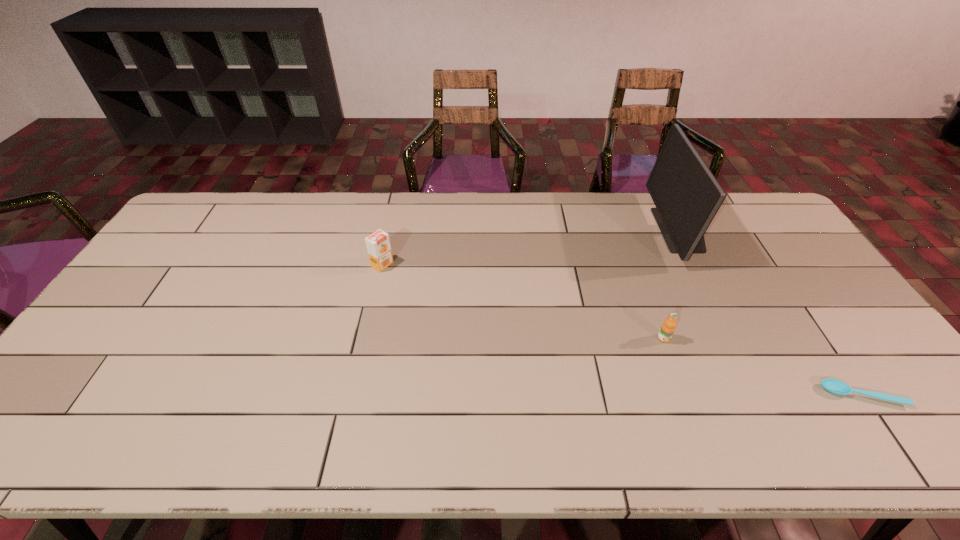
You are a GUI agent. You are given a task and a screenshot of the screen. Output one action in this format:
    pyautogui.click(x=<x>, y=<y>)
    Task: Click on the vacant area that lies between the second shortest object and the second tallest object
    The image size is (960, 540).
    Given the screenshot: What is the action you would take?
    pyautogui.click(x=523, y=302)

Locate an element on the screen. The width and height of the screenshot is (960, 540). unoccupied position between the second object from right to left and the second shortest object is located at coordinates (672, 284).

Where is `vacant space that is in between the rightmost object and the computer monitor`? The image size is (960, 540). vacant space that is in between the rightmost object and the computer monitor is located at coordinates (771, 313).

The width and height of the screenshot is (960, 540). What are the coordinates of `empty space between the second shortest object and the shortest object` in the screenshot? It's located at (763, 367).

At what (x,y) coordinates should I click in order to perform the action: click on free spot between the nearer orange juice and the nearest object. Please return your answer as a coordinate pair (x, y). This screenshot has height=540, width=960. Looking at the image, I should click on (763, 367).

You are a GUI agent. You are given a task and a screenshot of the screen. Output one action in this format:
    pyautogui.click(x=<x>, y=<y>)
    Task: Click on the vacant area that lies between the tallest object and the second object from left to right
    The image size is (960, 540).
    Given the screenshot: What is the action you would take?
    pyautogui.click(x=672, y=284)

Identify the location of free space between the right orange juice and the third object from left to right. Image resolution: width=960 pixels, height=540 pixels. (672, 284).

This screenshot has width=960, height=540. What are the coordinates of `vacant space that is in between the third tallest object and the spoon` in the screenshot? It's located at (763, 367).

Where is `free space between the farther orange juice and the rightmost object`? This screenshot has width=960, height=540. free space between the farther orange juice and the rightmost object is located at coordinates (622, 330).

Where is `vacant area that lies between the tallest object and the shorter orange juice`? Image resolution: width=960 pixels, height=540 pixels. vacant area that lies between the tallest object and the shorter orange juice is located at coordinates (672, 284).